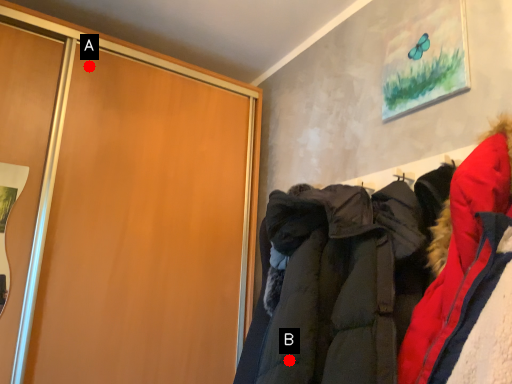
Question: Two points are circled on the image, labeled by A and B beside each circle. Which point is closer to the camera?

Choices:
 (A) A is closer
 (B) B is closer

Answer: (B)